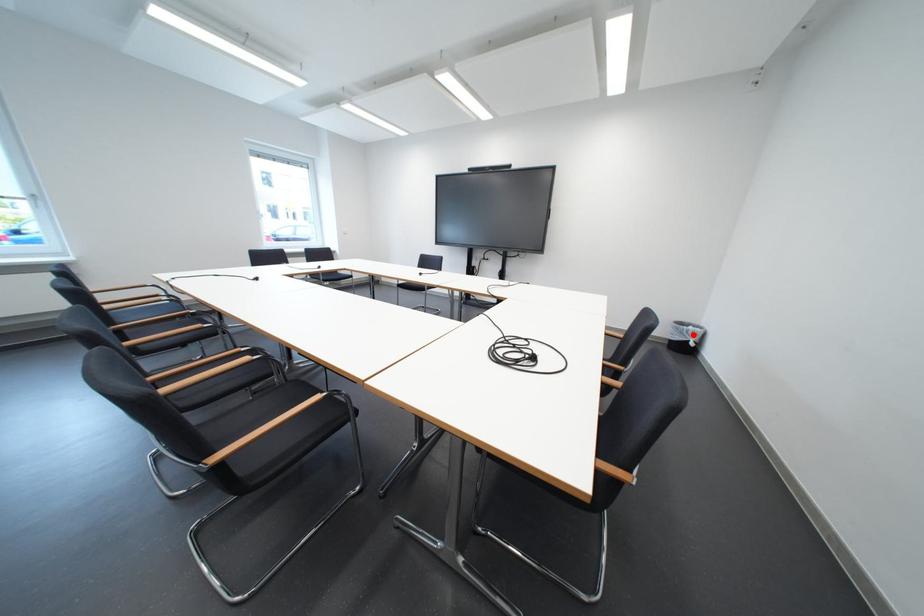
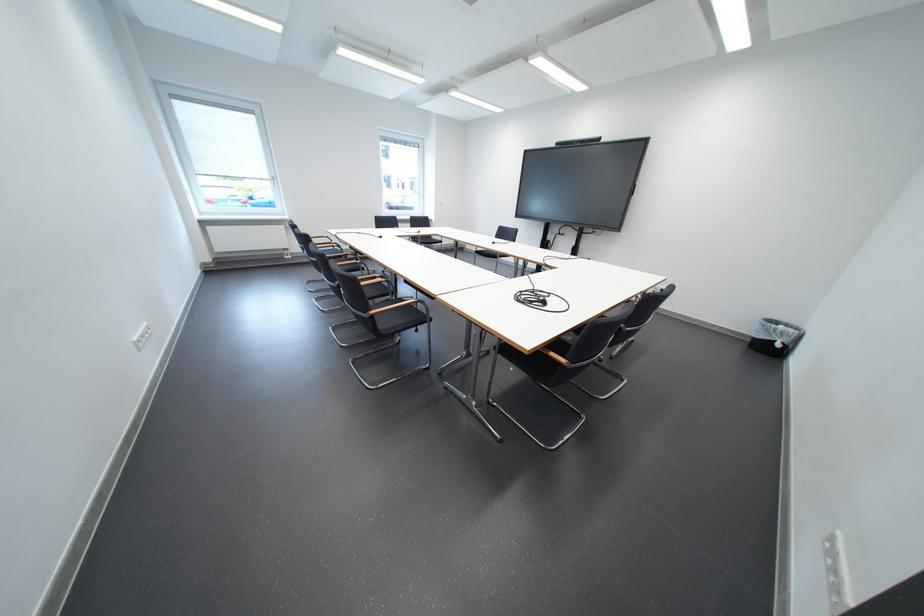
The point at the highlighted location is marked in the first image. Where is the corresponding point in the second image?

(780, 333)